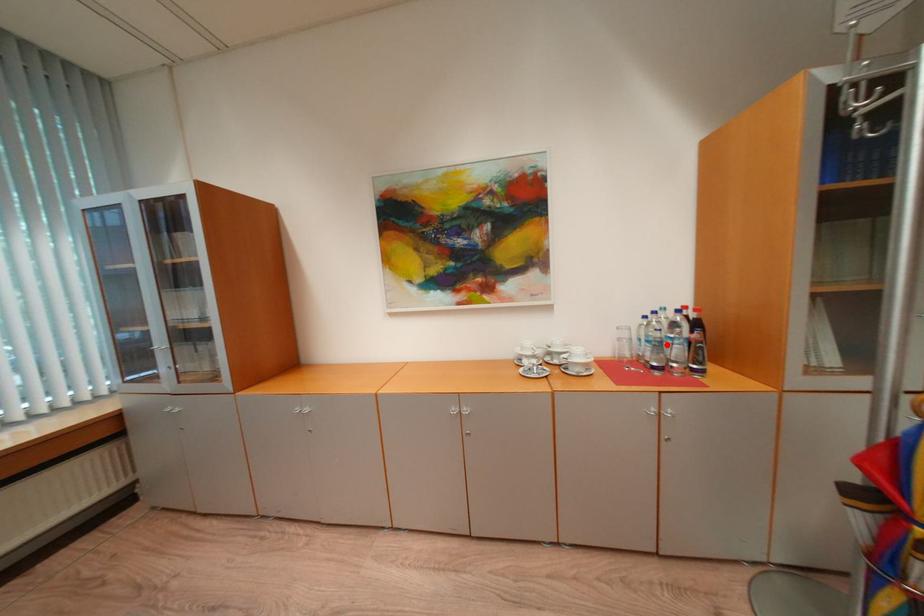
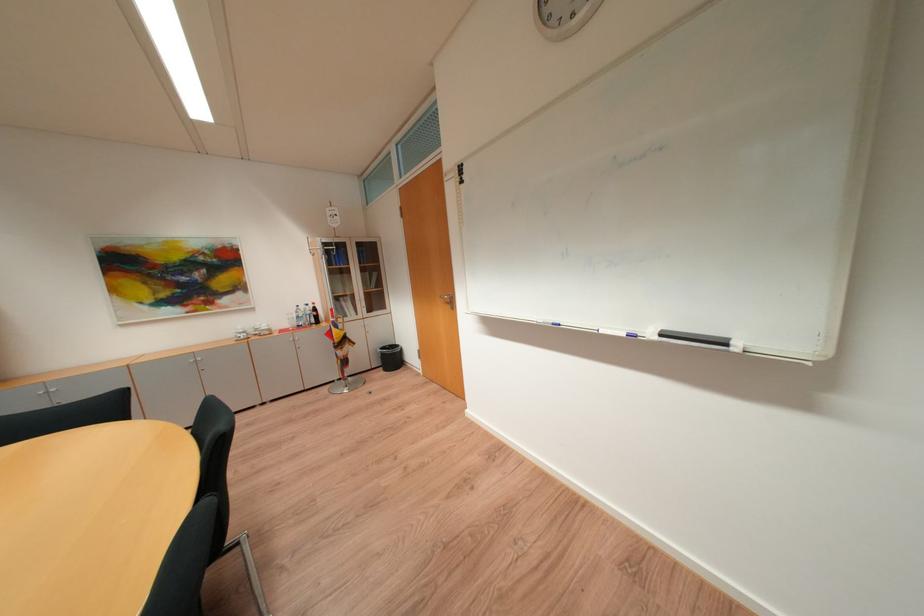
Find the pixel in the second image that matches the highlighted location in the first image.

(307, 318)